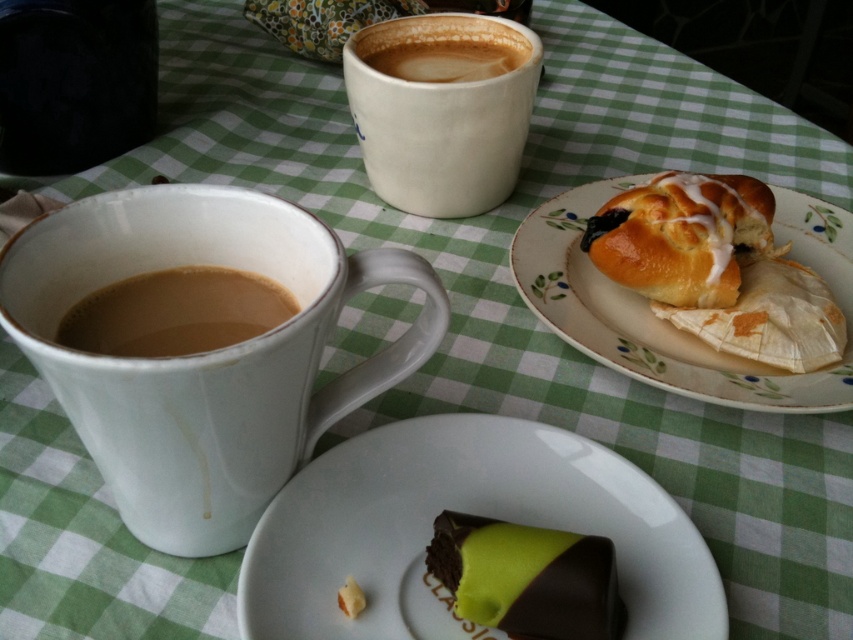
Question: Which point is farther from the camera taking this photo?

Choices:
 (A) (363, 45)
 (B) (53, 308)
 (C) (134, 332)
 (D) (354, 621)

Answer: (A)

Question: Can you confirm if white glossy plate at lower center is thinner than yellow matte cookie at lower center?

Choices:
 (A) yes
 (B) no

Answer: (B)

Question: Is white glossy plate at lower center below brown matte cup at left?

Choices:
 (A) yes
 (B) no

Answer: (A)

Question: Which object is positioned closest to the glazed golden bun at upper right?

Choices:
 (A) chocolate-coated green cake at lower center
 (B) brown matte cup at left
 (C) white ceramic mug at left

Answer: (A)

Question: Can you confirm if white ceramic mug at left is bigger than brown matte cup at left?

Choices:
 (A) yes
 (B) no

Answer: (A)

Question: Among these points, which one is farthest from the camera?

Choices:
 (A) (616, 234)
 (B) (496, 58)
 (C) (361, 444)
 (D) (548, 305)

Answer: (B)